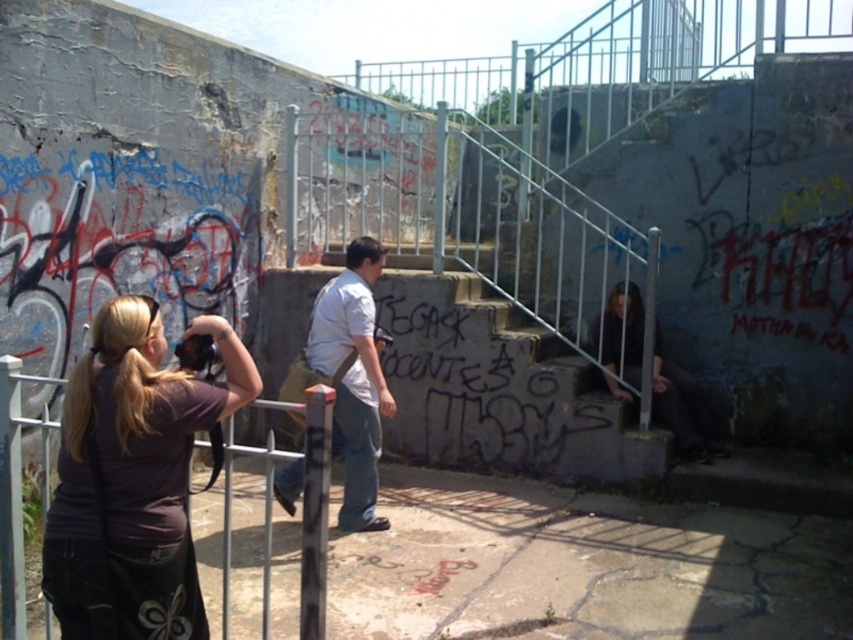
What do you see at coordinates (352, 378) in the screenshot? I see `white cotton shirt at center` at bounding box center [352, 378].

Does white cotton shirt at center lie in front of dark gray fabric pants at lower right?

Yes, white cotton shirt at center is closer to the viewer.

At what (x,y) coordinates should I click in order to perform the action: click on white cotton shirt at center. Please return your answer as a coordinate pair (x, y). This screenshot has width=853, height=640. Looking at the image, I should click on (352, 378).

Which is behind, point (80, 556) or point (688, 420)?

Point (688, 420)

Is matte purple shirt at left in front of dark gray fabric pants at lower right?

Yes, it is.

What do you see at coordinates (129, 456) in the screenshot?
I see `matte purple shirt at left` at bounding box center [129, 456].

The image size is (853, 640). In order to click on matte purple shirt at left in this screenshot , I will do `click(129, 456)`.

Does matte purple shirt at left appear over white cotton shirt at center?

No, matte purple shirt at left is not above white cotton shirt at center.

Between point (85, 573) and point (361, 305), which one is positioned in front?

Point (85, 573)

The height and width of the screenshot is (640, 853). What are the coordinates of `matte purple shirt at left` in the screenshot? It's located at (129, 456).